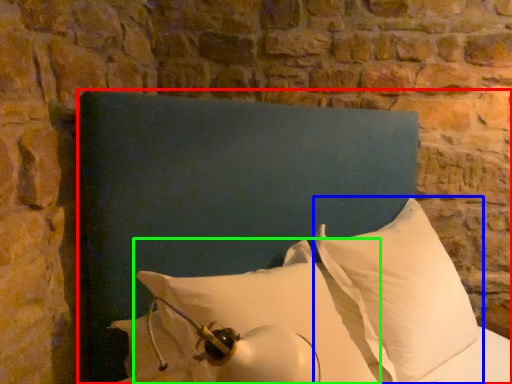
Question: Estimate the real-world distances between objects in this image. Which object is closer to furniture (highlighted by a red box), pillow (highlighted by a blue box) or pillow (highlighted by a green box)?

Choices:
 (A) pillow
 (B) pillow

Answer: (B)